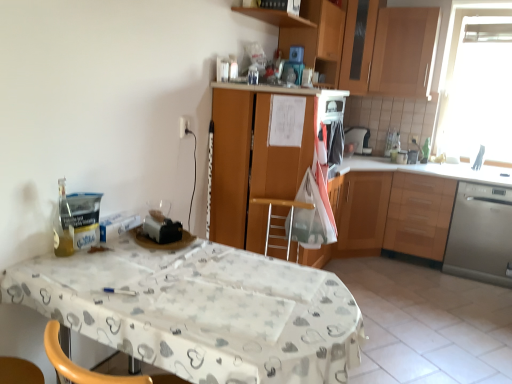
Question: Is white glossy tile at lower right a part of transparent glass window at upper right?

Choices:
 (A) yes
 (B) no

Answer: (B)

Question: Does transparent glass window at upper right have a greater width compared to white glossy tile at lower right?

Choices:
 (A) yes
 (B) no

Answer: (B)

Question: From a real-world perspective, is transparent glass window at upper right under white glossy tile at lower right?

Choices:
 (A) no
 (B) yes

Answer: (A)

Question: Is transparent glass window at upper right completely or partially outside of white glossy tile at lower right?

Choices:
 (A) yes
 (B) no

Answer: (A)

Question: Can you confirm if transparent glass window at upper right is shorter than white glossy tile at lower right?

Choices:
 (A) no
 (B) yes

Answer: (A)

Question: Is transparent glass window at upper right oriented away from white glossy tile at lower right?

Choices:
 (A) yes
 (B) no

Answer: (B)

Question: Does wooden cabinet at right, the 4th cabinetry from the left, have a greater height compared to wooden cabinet at upper center, marked as the 2th cabinetry in a left-to-right arrangement?

Choices:
 (A) yes
 (B) no

Answer: (A)

Question: Does wooden cabinet at right, which is the first cabinetry in right-to-left order, appear on the left side of wooden cabinet at upper center, acting as the 3th cabinetry starting from the right?

Choices:
 (A) no
 (B) yes

Answer: (A)

Question: Is wooden cabinet at right, which is the first cabinetry in right-to-left order, further to camera compared to wooden cabinet at upper center, marked as the 2th cabinetry in a left-to-right arrangement?

Choices:
 (A) yes
 (B) no

Answer: (A)

Question: Are wooden cabinet at right, the 4th cabinetry from the left, and wooden cabinet at upper center, acting as the 3th cabinetry starting from the right, beside each other?

Choices:
 (A) no
 (B) yes

Answer: (A)

Question: Is wooden cabinet at upper center, marked as the 2th cabinetry in a left-to-right arrangement, located within wooden cabinet at right, which is the first cabinetry in right-to-left order?

Choices:
 (A) no
 (B) yes

Answer: (A)

Question: Considering the relative sizes of wooden cabinet at right, the 4th cabinetry from the left, and wooden cabinet at upper center, acting as the 3th cabinetry starting from the right, in the image provided, is wooden cabinet at right, the 4th cabinetry from the left, smaller than wooden cabinet at upper center, acting as the 3th cabinetry starting from the right,?

Choices:
 (A) yes
 (B) no

Answer: (B)

Question: Is wooden cabinet at upper right, the 3th cabinetry positioned from the left, in contact with wooden cabinet at right, the 4th cabinetry from the left?

Choices:
 (A) yes
 (B) no

Answer: (B)